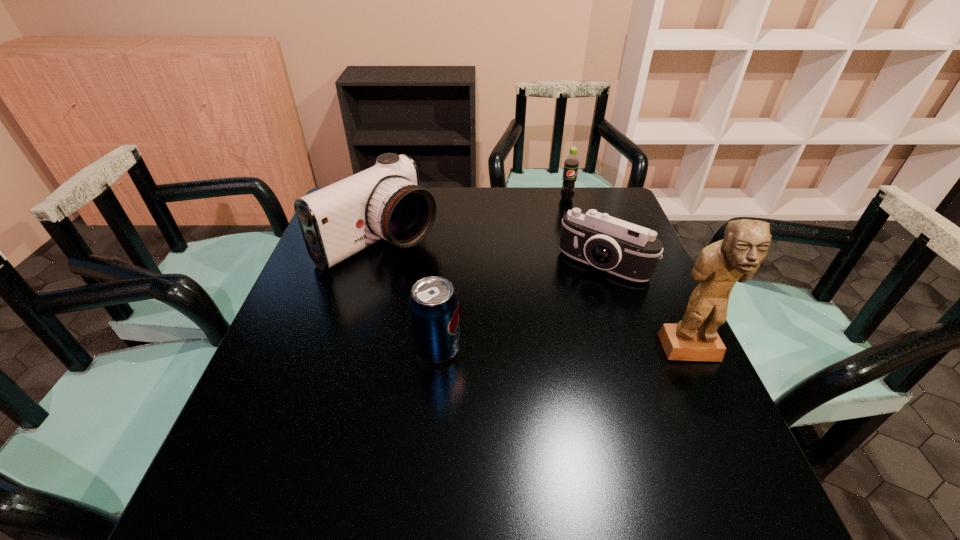
This screenshot has height=540, width=960. In order to click on vacant space that is in between the left soda and the camera in this screenshot , I will do `click(520, 307)`.

Locate which object is the closest to the camera. Please provide its 2D coordinates. Your answer should be formatted as a tuple, i.e. [(x, y)], where the tuple contains the x and y coordinates of a point satisfying the conditions above.

[(737, 257)]

Where is `object that is the closest to the left soda`? This screenshot has height=540, width=960. object that is the closest to the left soda is located at coordinates (386, 201).

This screenshot has height=540, width=960. I want to click on vacant space that satisfies the following two spatial constraints: 1. on the back side of the left soda; 2. on the right side of the farther soda, so click(451, 199).